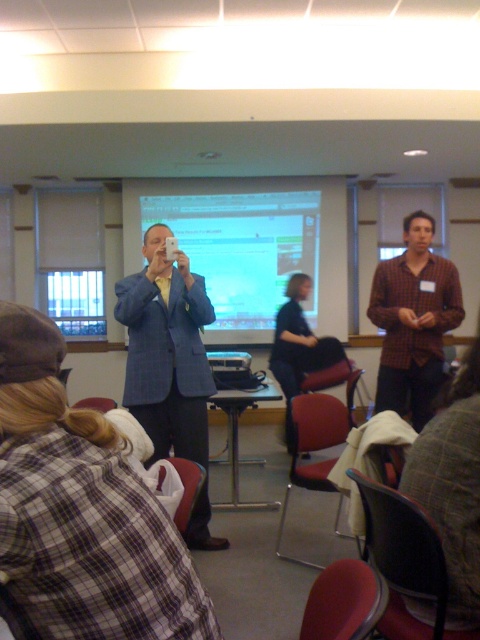
You are a photographer standing at the back of the conference room. You need to take a photo of the plaid shirt at center and the black plastic projector at center without any obstruction. Given that the distance between them is 1.25 meters, can you position yourself in a way that both are in frame and clearly visible?

The plaid shirt at center is 1.25 meters from the black plastic projector at center, so yes, you can position yourself to capture both in the frame as they are relatively close to each other and there are no mentioned obstructions between them.

You are organizing an event in this conference room and need to place a 1.2 meter wide banner between the blue textured blazer at center and the black plastic projector at center. Can you fit it there?

The blue textured blazer at center is wider than the black plastic projector at center. Since the banner is 1.2 meters wide, it may not fit if the space between them is narrower than 1.2 meters. However, the description only states the blazer is wider than the projector, not the distance between them. Therefore, insufficient information is provided to determine if the banner will fit.